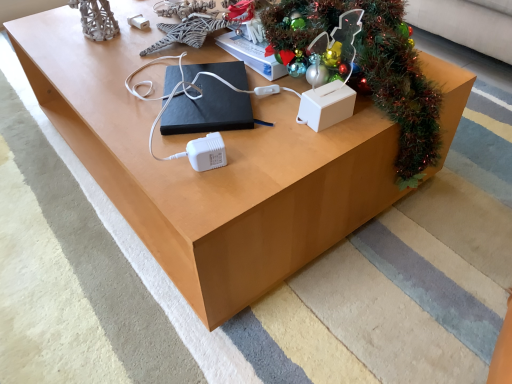
Question: Is the position of black matte book at center more distant than that of white plastic tissue box at center-right?

Choices:
 (A) no
 (B) yes

Answer: (B)

Question: Does black matte book at center have a lesser width compared to white plastic tissue box at center-right?

Choices:
 (A) yes
 (B) no

Answer: (B)

Question: From the image's perspective, is black matte book at center under white plastic tissue box at center-right?

Choices:
 (A) no
 (B) yes

Answer: (A)

Question: Considering the relative positions of black matte book at center and white plastic tissue box at center-right in the image provided, is black matte book at center in front of white plastic tissue box at center-right?

Choices:
 (A) yes
 (B) no

Answer: (B)

Question: Would you say white plastic tissue box at center-right is part of black matte book at center's contents?

Choices:
 (A) no
 (B) yes

Answer: (A)

Question: Considering the positions of black matte book at center and green shiny garland at upper right in the image, is black matte book at center taller or shorter than green shiny garland at upper right?

Choices:
 (A) tall
 (B) short

Answer: (B)

Question: Choose the correct answer: Is black matte book at center inside green shiny garland at upper right or outside it?

Choices:
 (A) inside
 (B) outside

Answer: (B)

Question: In the image, is black matte book at center positioned in front of or behind green shiny garland at upper right?

Choices:
 (A) behind
 (B) front

Answer: (A)

Question: Looking at the image, does black matte book at center seem bigger or smaller compared to green shiny garland at upper right?

Choices:
 (A) small
 (B) big

Answer: (A)

Question: From a real-world perspective, relative to black matte book at center, is white plastic tissue box at center-right vertically above or below?

Choices:
 (A) above
 (B) below

Answer: (A)

Question: In terms of height, does white plastic tissue box at center-right look taller or shorter compared to black matte book at center?

Choices:
 (A) tall
 (B) short

Answer: (A)

Question: Considering the positions of white plastic tissue box at center-right and black matte book at center in the image, is white plastic tissue box at center-right bigger or smaller than black matte book at center?

Choices:
 (A) small
 (B) big

Answer: (A)

Question: Does point (348, 89) appear closer or farther from the camera than point (181, 102)?

Choices:
 (A) farther
 (B) closer

Answer: (B)

Question: In terms of width, does green shiny garland at upper right look wider or thinner when compared to black matte book at center?

Choices:
 (A) wide
 (B) thin

Answer: (A)

Question: Is green shiny garland at upper right bigger or smaller than black matte book at center?

Choices:
 (A) big
 (B) small

Answer: (A)